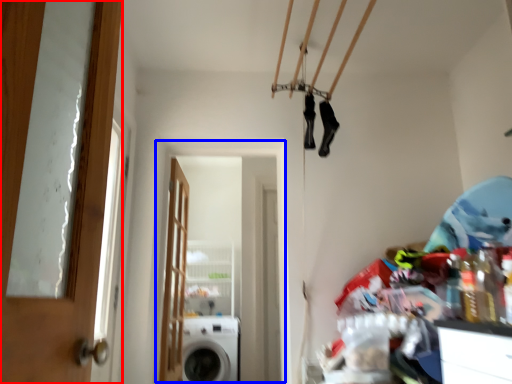
Question: Which of the following is the farthest to the observer, door (highlighted by a red box) or screen door (highlighted by a blue box)?

Choices:
 (A) door
 (B) screen door

Answer: (B)